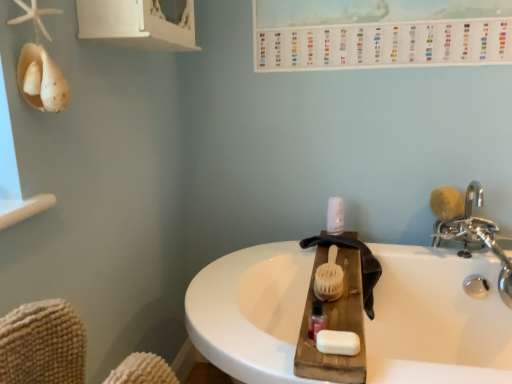
Find the location of a particular element. This screenshot has width=512, height=384. free space to the back side of pink glossy bottle at center is located at coordinates (331, 296).